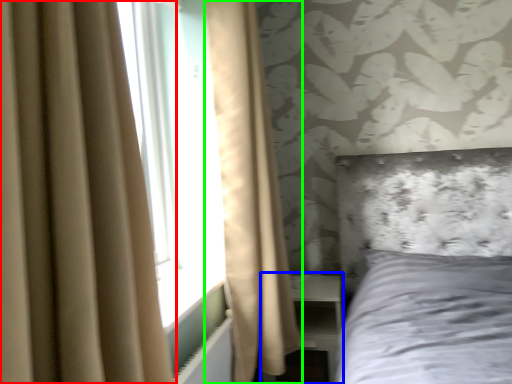
Question: Which is farther away from curtain (highlighted by a red box)? dresser (highlighted by a blue box) or curtain (highlighted by a green box)?

Choices:
 (A) dresser
 (B) curtain

Answer: (A)